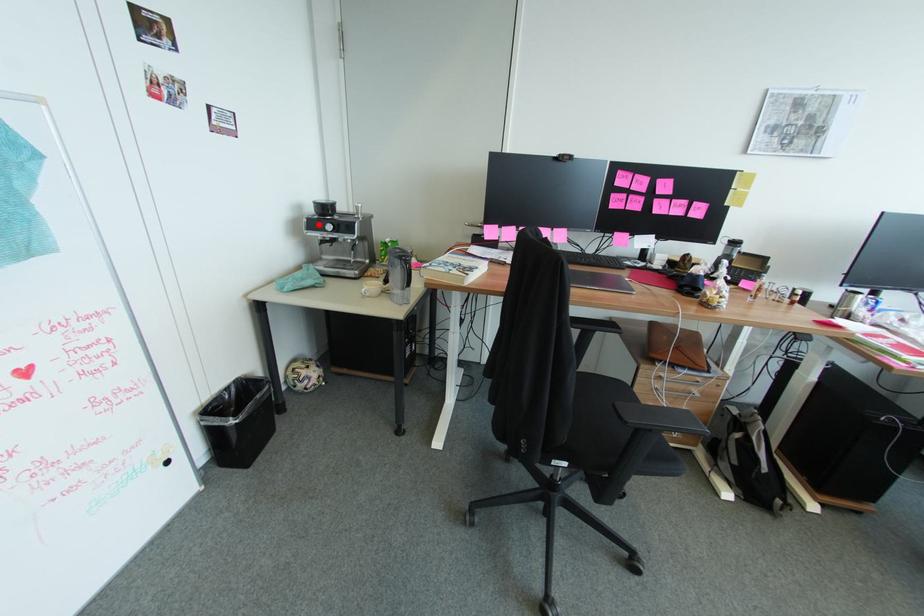
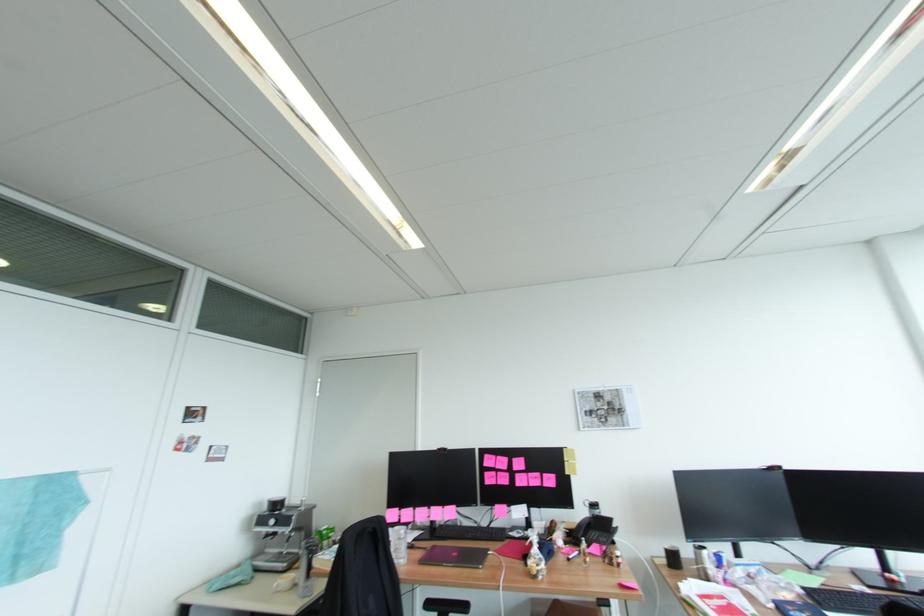
Question: I am providing you with two images of the same scene from different viewpoints. A red point is marked on the first image. Is the red point's position out of view in image 2?

Choices:
 (A) Yes
 (B) No

Answer: (B)